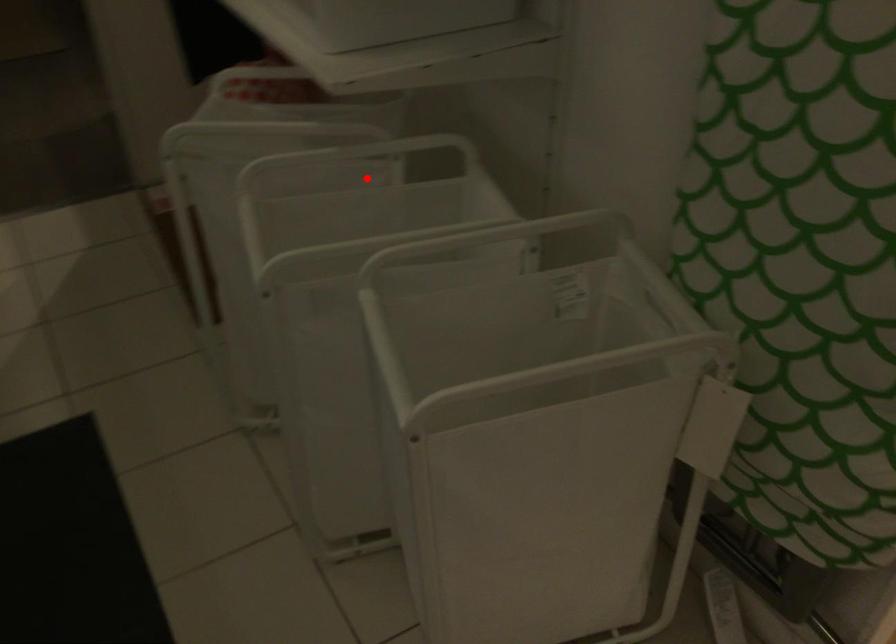
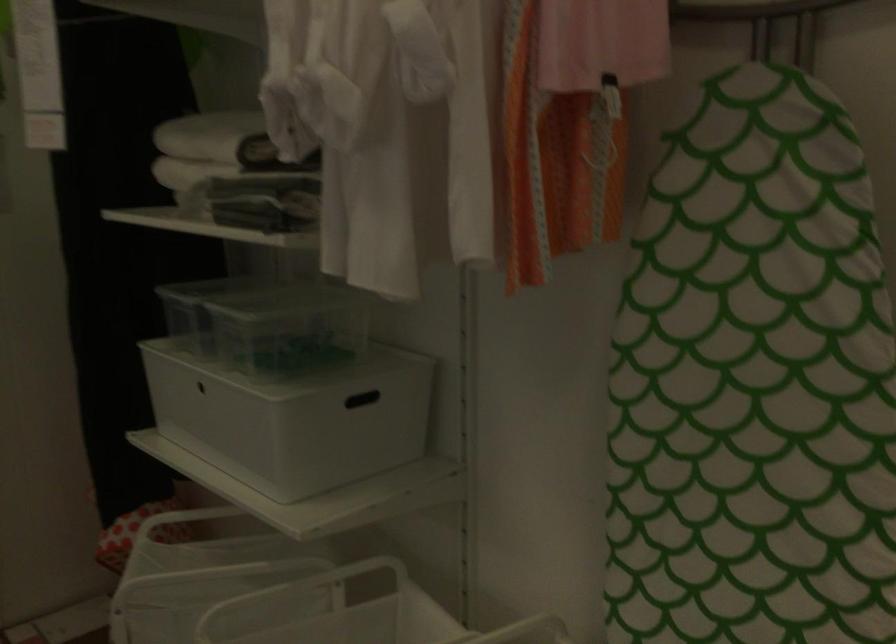
In the second image, find the point that corresponds to the highlighted location in the first image.

(309, 611)